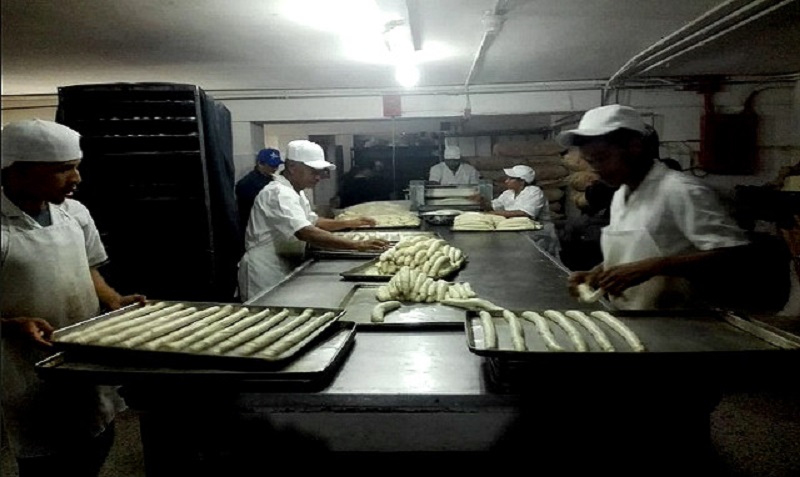
Where is `tray`? tray is located at coordinates (664, 320).